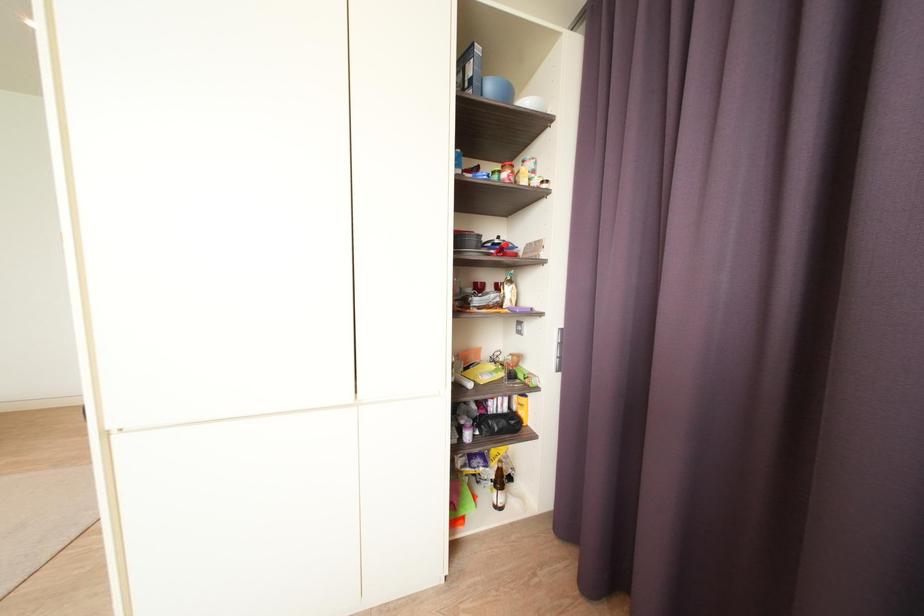
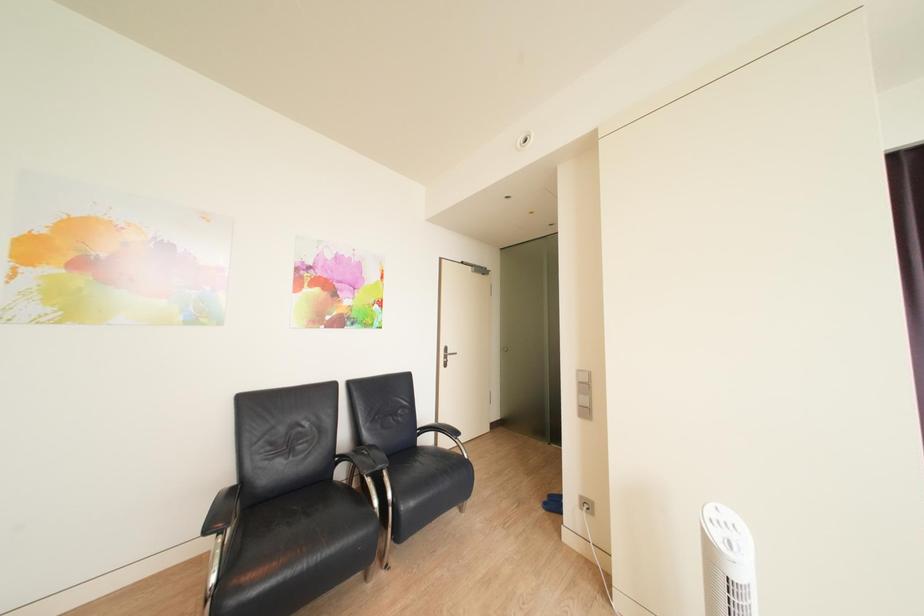
Question: The images are taken continuously from a first-person perspective. In which direction are you moving?

Choices:
 (A) Left
 (B) Right
 (C) Forward
 (D) Backward

Answer: (A)